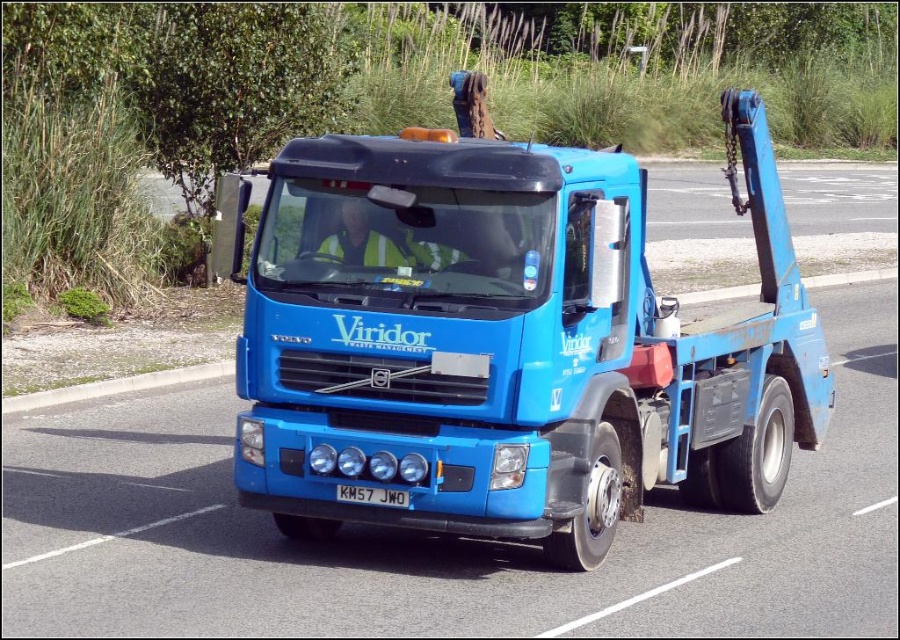
What are the coordinates of the blue matte tow truck at center?

The coordinates of the blue matte tow truck at center are at point (509, 342).